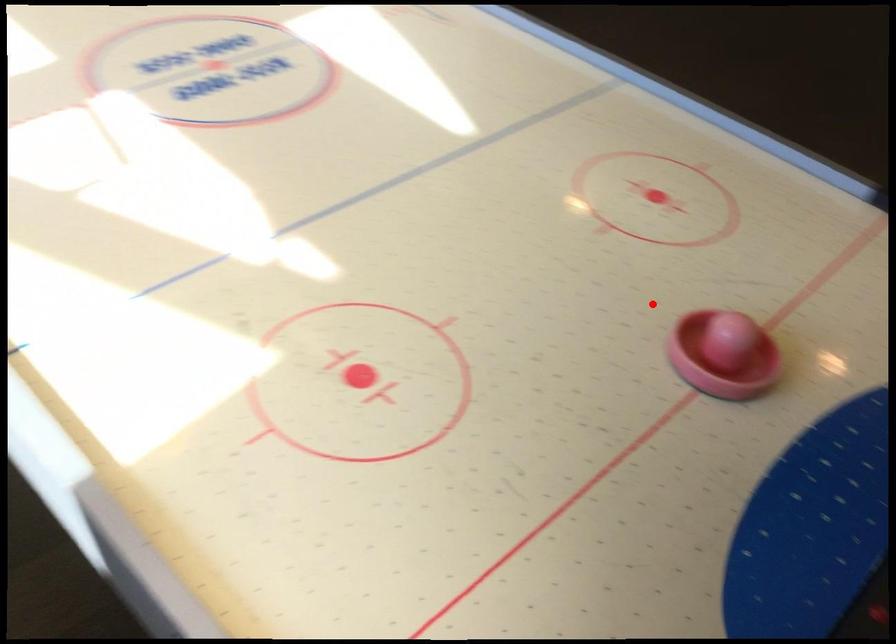
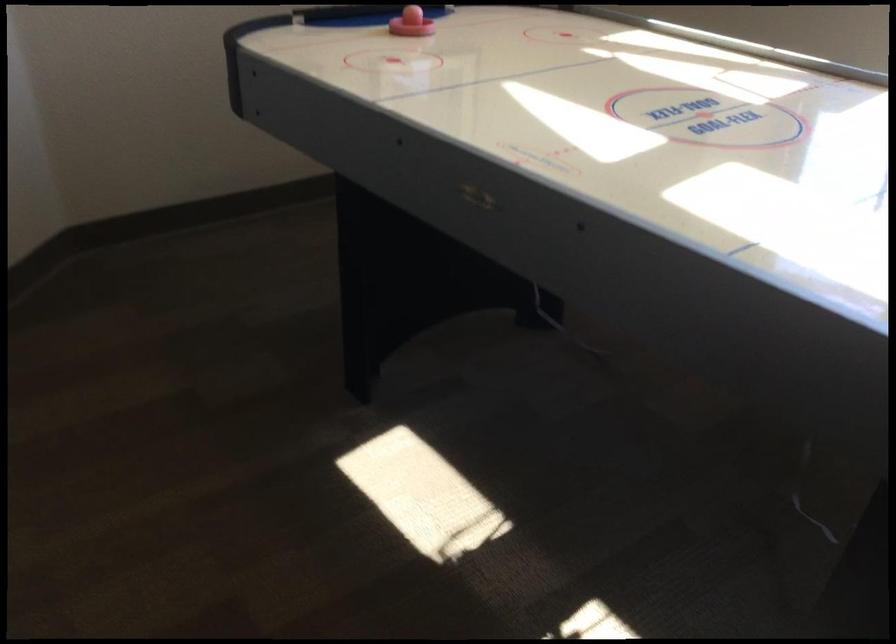
In the second image, find the point that corresponds to the highlighted location in the first image.

(410, 23)